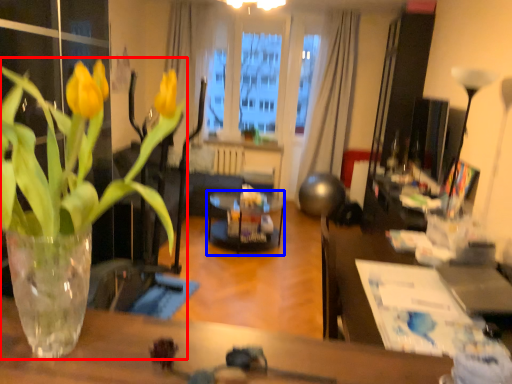
Question: Among these objects, which one is farthest to the camera, houseplant (highlighted by a red box) or glass table (highlighted by a blue box)?

Choices:
 (A) houseplant
 (B) glass table

Answer: (B)